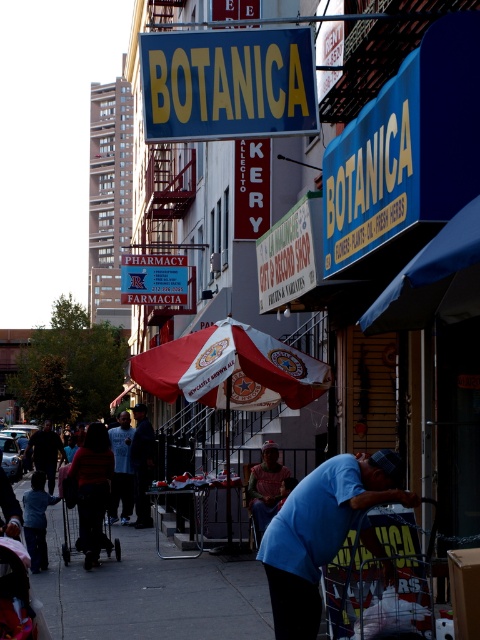
Question: Which point is closer to the camera?

Choices:
 (A) (272, 564)
 (B) (51, 486)

Answer: (A)

Question: Can you confirm if metallic silver cart at lower center is positioned to the left of dark blue shirt at center?

Choices:
 (A) no
 (B) yes

Answer: (A)

Question: Observing the image, what is the correct spatial positioning of blue denim jeans at center in reference to light blue t-shirt at center?

Choices:
 (A) above
 (B) below

Answer: (A)

Question: Is white fabric umbrella at center wider than blue denim jeans at center?

Choices:
 (A) yes
 (B) no

Answer: (A)

Question: Which object is positioned closest to the white fabric umbrella at center?

Choices:
 (A) dark blue shirt at center
 (B) blue fabric cart at lower center

Answer: (B)

Question: Which point appears farthest from the camera in this image?

Choices:
 (A) (119, 420)
 (B) (351, 499)
 (C) (29, 445)

Answer: (C)